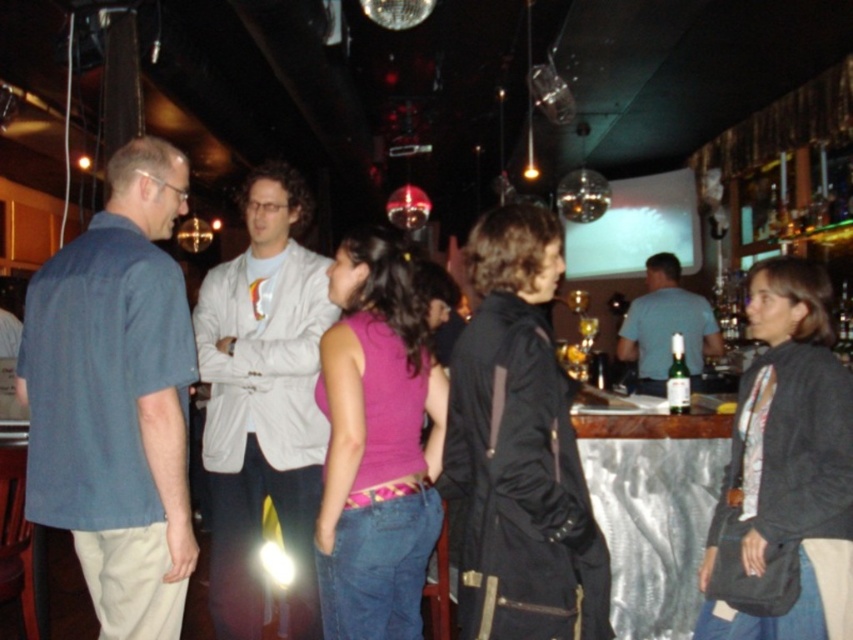
Is dark gray sweater at center below light blue shirt at center?

Yes, dark gray sweater at center is below light blue shirt at center.

Does dark gray sweater at center have a greater width compared to light blue shirt at center?

No, dark gray sweater at center is not wider than light blue shirt at center.

This screenshot has width=853, height=640. What are the coordinates of `dark gray sweater at center` in the screenshot? It's located at (785, 474).

The image size is (853, 640). I want to click on dark gray sweater at center, so click(x=785, y=474).

Is point (80, 540) farther from camera compared to point (534, 552)?

Yes.

Does blue cotton shirt at left appear on the left side of matte black jacket at center?

Correct, you'll find blue cotton shirt at left to the left of matte black jacket at center.

Is point (113, 497) more distant than point (556, 499)?

Yes, it is behind point (556, 499).

Find the location of a particular element. blue cotton shirt at left is located at coordinates (115, 397).

Is light gray fabric jacket at center thinner than light blue shirt at center?

Indeed, light gray fabric jacket at center has a lesser width compared to light blue shirt at center.

Does point (279, 198) come closer to viewer compared to point (672, 273)?

Yes.

The height and width of the screenshot is (640, 853). In order to click on light gray fabric jacket at center in this screenshot , I will do `click(263, 403)`.